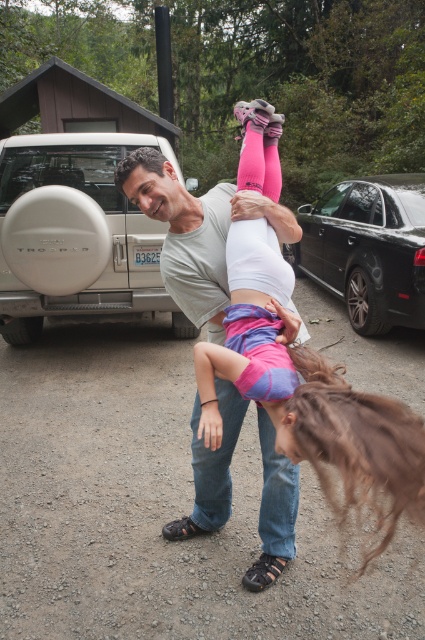
Is white matte spare tire at left bigger than matte gray shirt at center?

Yes.

Between point (42, 221) and point (266, 125), which one is positioned behind?

Positioned behind is point (42, 221).

Locate an element on the screen. The height and width of the screenshot is (640, 425). white matte spare tire at left is located at coordinates (76, 236).

Who is positioned more to the right, white matte spare tire at left or black metallic car at right?

black metallic car at right is more to the right.

Locate an element on the screen. The height and width of the screenshot is (640, 425). white matte spare tire at left is located at coordinates pyautogui.click(x=76, y=236).

Does pink fabric pants at center have a greater height compared to white matte spare tire at left?

Yes, pink fabric pants at center is taller than white matte spare tire at left.

Is point (280, 417) in front of point (64, 157)?

Yes.

This screenshot has height=640, width=425. What do you see at coordinates (306, 392) in the screenshot? I see `pink fabric pants at center` at bounding box center [306, 392].

Find the location of a particular element. The image size is (425, 640). pink fabric pants at center is located at coordinates (306, 392).